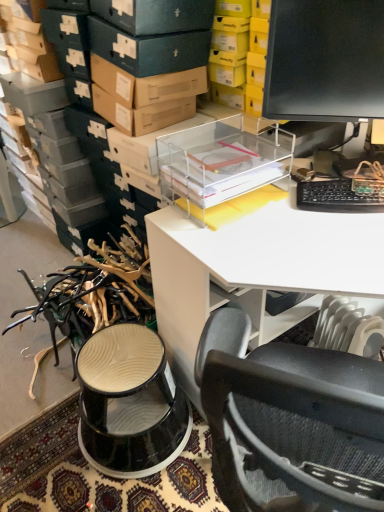
Locate an element on the screen. free space above transparent plastic desk at upper center (from a real-world perspective) is located at coordinates (306, 216).